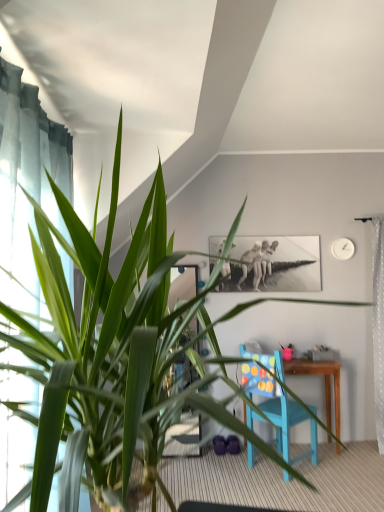
Image resolution: width=384 pixels, height=512 pixels. Find the location of `vacant point to the right of matte blue chair at center`. vacant point to the right of matte blue chair at center is located at coordinates (349, 471).